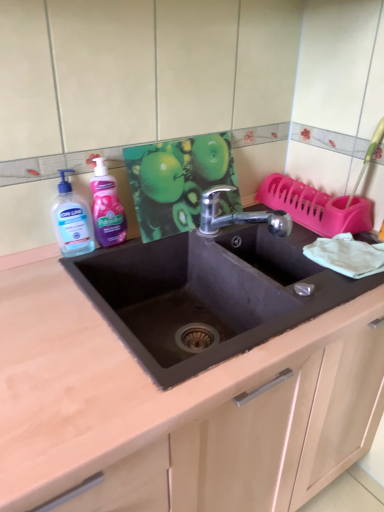
Question: From the image's perspective, is black matte sink at center below transparent liquid soap at left, positioned as the 2th cleaning product in right-to-left order?

Choices:
 (A) yes
 (B) no

Answer: (A)

Question: Can you confirm if black matte sink at center is wider than transparent liquid soap at left, positioned as the 2th cleaning product in right-to-left order?

Choices:
 (A) no
 (B) yes

Answer: (B)

Question: Can you confirm if black matte sink at center is taller than transparent liquid soap at left, positioned as the 2th cleaning product in right-to-left order?

Choices:
 (A) yes
 (B) no

Answer: (A)

Question: Does black matte sink at center have a smaller size compared to transparent liquid soap at left, acting as the first cleaning product starting from the left?

Choices:
 (A) no
 (B) yes

Answer: (A)

Question: Is black matte sink at center surrounding transparent liquid soap at left, acting as the first cleaning product starting from the left?

Choices:
 (A) no
 (B) yes

Answer: (A)

Question: Considering the relative sizes of black matte sink at center and transparent liquid soap at left, acting as the first cleaning product starting from the left, in the image provided, is black matte sink at center thinner than transparent liquid soap at left, acting as the first cleaning product starting from the left,?

Choices:
 (A) no
 (B) yes

Answer: (A)

Question: From a real-world perspective, is black matte sink at center located higher than transparent liquid soap at left, acting as the first cleaning product starting from the left?

Choices:
 (A) yes
 (B) no

Answer: (B)

Question: Is black matte sink at center not near transparent liquid soap at left, positioned as the 2th cleaning product in right-to-left order?

Choices:
 (A) yes
 (B) no

Answer: (B)

Question: Is the position of black matte sink at center more distant than that of transparent liquid soap at left, positioned as the 2th cleaning product in right-to-left order?

Choices:
 (A) yes
 (B) no

Answer: (B)

Question: Can you confirm if black matte sink at center is smaller than transparent liquid soap at left, acting as the first cleaning product starting from the left?

Choices:
 (A) no
 (B) yes

Answer: (A)

Question: Considering the relative sizes of black matte sink at center and transparent liquid soap at left, positioned as the 2th cleaning product in right-to-left order, in the image provided, is black matte sink at center thinner than transparent liquid soap at left, positioned as the 2th cleaning product in right-to-left order,?

Choices:
 (A) yes
 (B) no

Answer: (B)

Question: Is transparent liquid soap at left, acting as the first cleaning product starting from the left, at the back of black matte sink at center?

Choices:
 (A) no
 (B) yes

Answer: (A)

Question: Is transparent liquid soap at left, acting as the first cleaning product starting from the left, thinner than black matte sink at center?

Choices:
 (A) no
 (B) yes

Answer: (B)